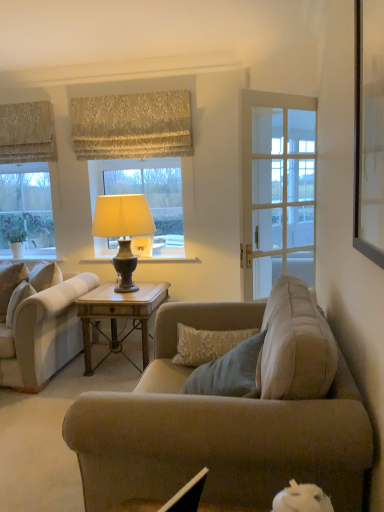
Question: Is clear glass window at left, which ranks as the 1th window in left-to-right order, at the left side of gold textured fabric at upper center, arranged as the second curtain when viewed from the left?

Choices:
 (A) no
 (B) yes

Answer: (B)

Question: Does clear glass window at left, arranged as the 2th window when viewed from the right, have a greater height compared to gold textured fabric at upper center, the 1th curtain viewed from the right?

Choices:
 (A) yes
 (B) no

Answer: (A)

Question: Is clear glass window at left, which ranks as the 1th window in left-to-right order, touching gold textured fabric at upper center, the 1th curtain viewed from the right?

Choices:
 (A) no
 (B) yes

Answer: (A)

Question: Is the depth of clear glass window at left, arranged as the 2th window when viewed from the right, less than that of gold textured fabric at upper center, arranged as the second curtain when viewed from the left?

Choices:
 (A) yes
 (B) no

Answer: (B)

Question: From a real-world perspective, does clear glass window at left, arranged as the 2th window when viewed from the right, sit lower than gold textured fabric at upper center, the 1th curtain viewed from the right?

Choices:
 (A) no
 (B) yes

Answer: (B)

Question: Would you say clear glass window at left, which ranks as the 1th window in left-to-right order, contains gold textured fabric at upper center, arranged as the second curtain when viewed from the left?

Choices:
 (A) yes
 (B) no

Answer: (B)

Question: Is white glass window at center, placed as the first window when sorted from right to left, next to clear glass window at left, arranged as the 2th window when viewed from the right, and touching it?

Choices:
 (A) no
 (B) yes

Answer: (A)

Question: Can you confirm if white glass window at center, which appears as the second window when viewed from the left, is smaller than clear glass window at left, arranged as the 2th window when viewed from the right?

Choices:
 (A) no
 (B) yes

Answer: (B)

Question: Can you confirm if white glass window at center, which appears as the second window when viewed from the left, is taller than clear glass window at left, arranged as the 2th window when viewed from the right?

Choices:
 (A) yes
 (B) no

Answer: (B)

Question: Considering the relative positions of white glass window at center, placed as the first window when sorted from right to left, and clear glass window at left, which ranks as the 1th window in left-to-right order, in the image provided, is white glass window at center, placed as the first window when sorted from right to left, to the left of clear glass window at left, which ranks as the 1th window in left-to-right order, from the viewer's perspective?

Choices:
 (A) yes
 (B) no

Answer: (B)

Question: Is white glass window at center, placed as the first window when sorted from right to left, looking in the opposite direction of clear glass window at left, which ranks as the 1th window in left-to-right order?

Choices:
 (A) no
 (B) yes

Answer: (A)

Question: Is white glass window at center, placed as the first window when sorted from right to left, facing towards clear glass window at left, arranged as the 2th window when viewed from the right?

Choices:
 (A) no
 (B) yes

Answer: (A)

Question: Is white glass window at center, placed as the first window when sorted from right to left, far away from wooden table at center?

Choices:
 (A) no
 (B) yes

Answer: (A)